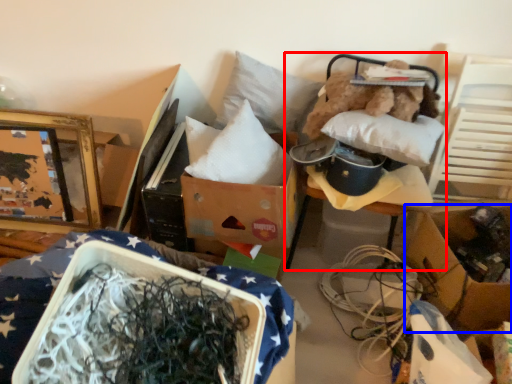
Question: Which object appears closest to the camera in this image, furniture (highlighted by a red box) or cardboard box (highlighted by a blue box)?

Choices:
 (A) furniture
 (B) cardboard box

Answer: (A)